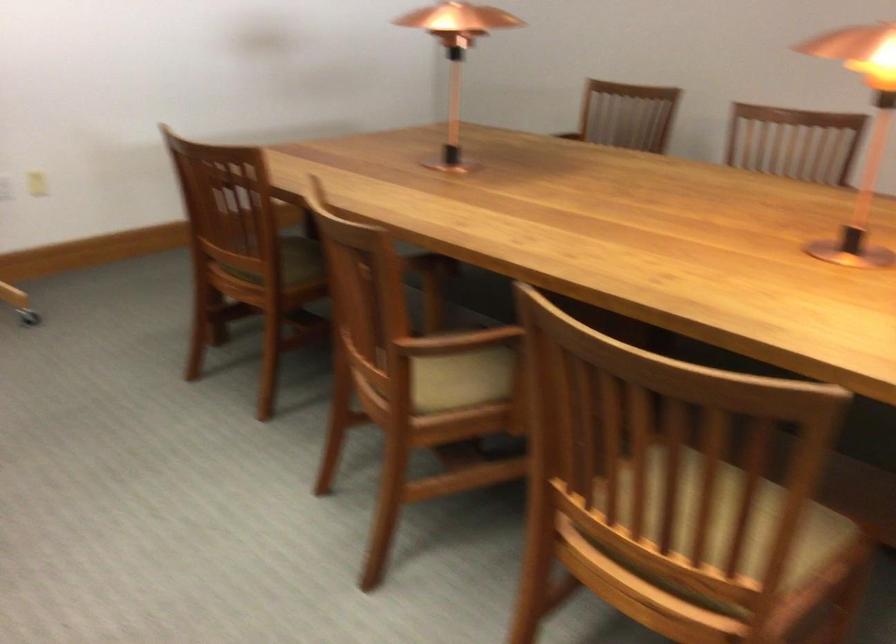
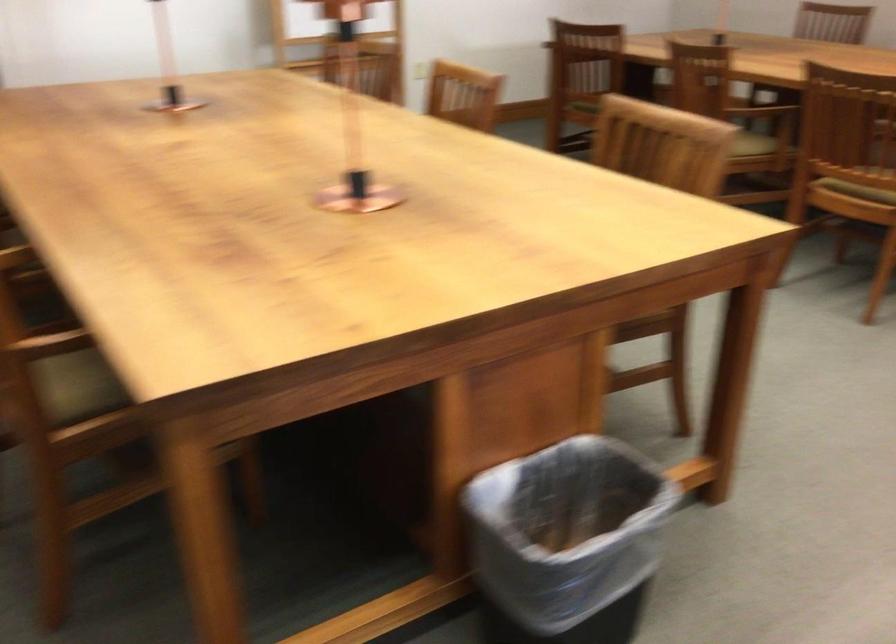
Find the pixel in the second image that matches point (235, 301) in the first image.

(583, 106)